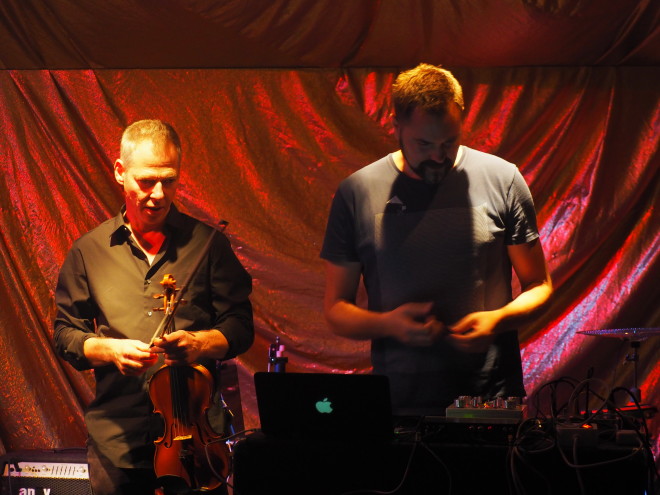
This screenshot has width=660, height=495. I want to click on audio mixer, so click(474, 408).